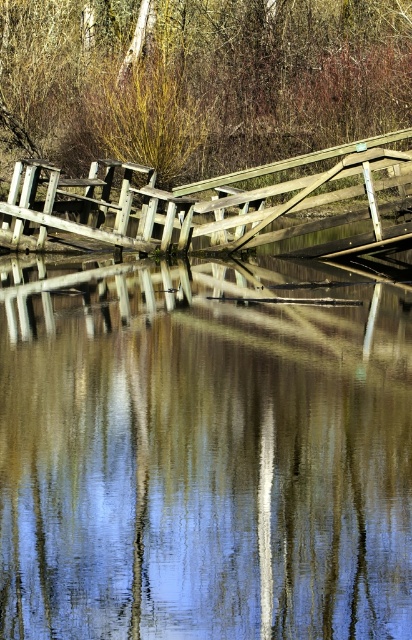
In the scene shown: You are a hiker who wants to cross the wooden bridge but notices the transparent water at center and the brown wood tree at upper center. Which object is located higher in the scene?

The brown wood tree at upper center is located higher than the transparent water at center in the scene.

You are standing on the wooden bridge in the image and want to cross to the other side. The bridge is leaning and partially submerged. To avoid getting your feet wet, where should you step based on the transparent water at center coordinates?

The transparent water at center is located at coordinates point (x=201, y=460), so you should step away from that area to avoid getting your feet wet.